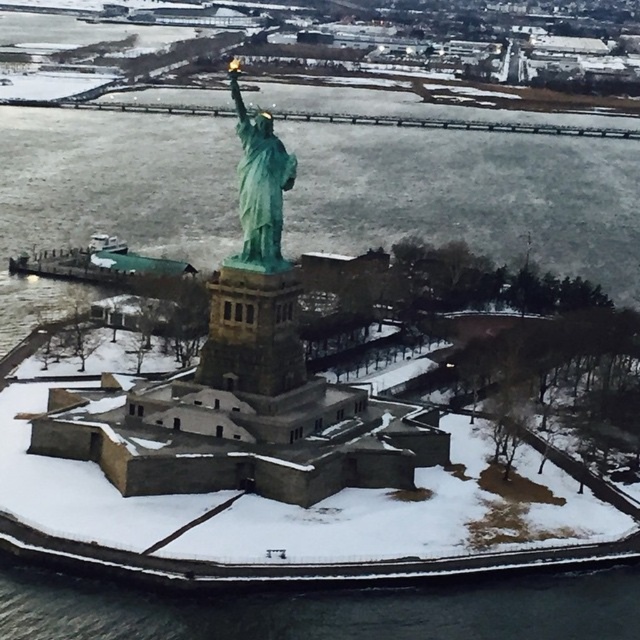
You are a photographer planning to capture the Statue of Liberty from a drone. You want to ensure that both the black water at lower center and the green patina statue at center are visible in your shot. Based on their heights, which object will appear smaller in the photo?

The black water at lower center has a lesser height compared to the green patina statue at center, so the black water at lower center will appear smaller in the photo.

You are a tourist standing on Liberty Island during winter. You see the black water at lower center and the green patina statue at center. Which object is positioned to the right of the other?

The black water at lower center is to the right of the green patina statue at center according to the description.

You are a photographer standing at the camera position. You want to capture a closeup shot of the black water at lower center. Given that your telephoto lens can focus on objects up to 250 feet away, will you be able to take the photo without moving closer?

The black water at lower center is 267.27 feet away from the camera, which exceeds the telephoto lens maximum focus range of 250 feet. Therefore, you cannot take the photo without moving closer.